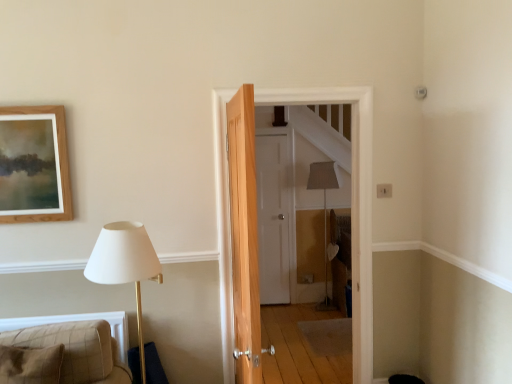
This screenshot has width=512, height=384. I want to click on vacant point above wooden door at center, placed as the 1th door when sorted from front to back (from a real-world perspective), so click(x=301, y=86).